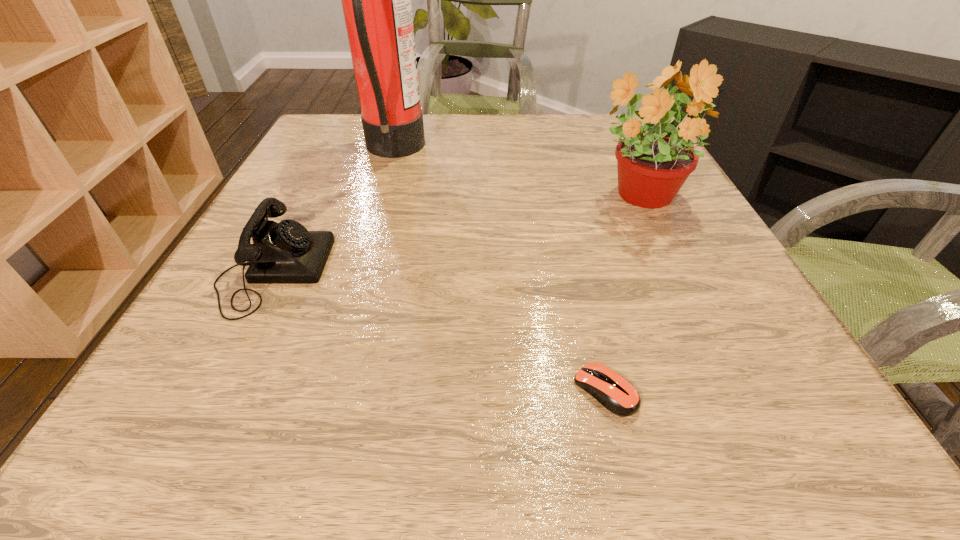
At what (x,y) coordinates should I click in order to perform the action: click on free spot that satisfies the following two spatial constraints: 1. on the back side of the flowerpot; 2. on the front-facing side of the tallest object. Please return your answer as a coordinate pair (x, y). The height and width of the screenshot is (540, 960). Looking at the image, I should click on (615, 151).

Identify the location of free point that satisfies the following two spatial constraints: 1. on the back side of the rightmost object; 2. on the left side of the computer mouse. This screenshot has width=960, height=540. (559, 197).

In order to click on blank area in the image that satisfies the following two spatial constraints: 1. on the back side of the rightmost object; 2. on the front-facing side of the fire extinguisher in this screenshot , I will do `click(615, 151)`.